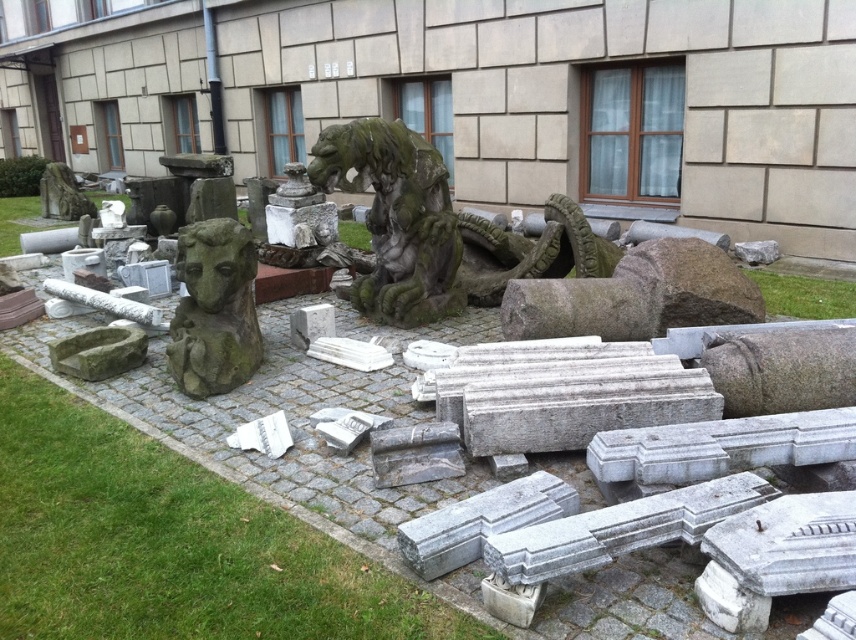
Which is above, green grass at lower right or green mossy stone gargoyle at upper left?

green mossy stone gargoyle at upper left is above.

Locate an element on the screen. This screenshot has width=856, height=640. green grass at lower right is located at coordinates (804, 294).

Is point (779, 282) farther from viewer compared to point (49, 180)?

That is False.

Locate an element on the screen. The height and width of the screenshot is (640, 856). green grass at lower right is located at coordinates (804, 294).

Is green grass at center below green mossy stone at center?

Correct, green grass at center is located below green mossy stone at center.

Which of these two, green grass at center or green mossy stone at center, stands taller?

green mossy stone at center

Does point (46, 541) lie behind point (15, 230)?

No, it is in front of (15, 230).

You are a GUI agent. You are given a task and a screenshot of the screen. Output one action in this format:
    pyautogui.click(x=<x>, y=<y>)
    Task: Click on the green grass at center
    
    Given the screenshot: What is the action you would take?
    pyautogui.click(x=165, y=541)

Can you confirm if green grass at lower left is positioned to the left of green grass at lower right?

Yes, green grass at lower left is to the left of green grass at lower right.

Consider the image. Can you confirm if green grass at lower left is bigger than green grass at lower right?

Yes.

Between point (366, 593) and point (848, 288), which one is positioned behind?

The point (848, 288) is behind.

The width and height of the screenshot is (856, 640). I want to click on green grass at lower left, so click(168, 544).